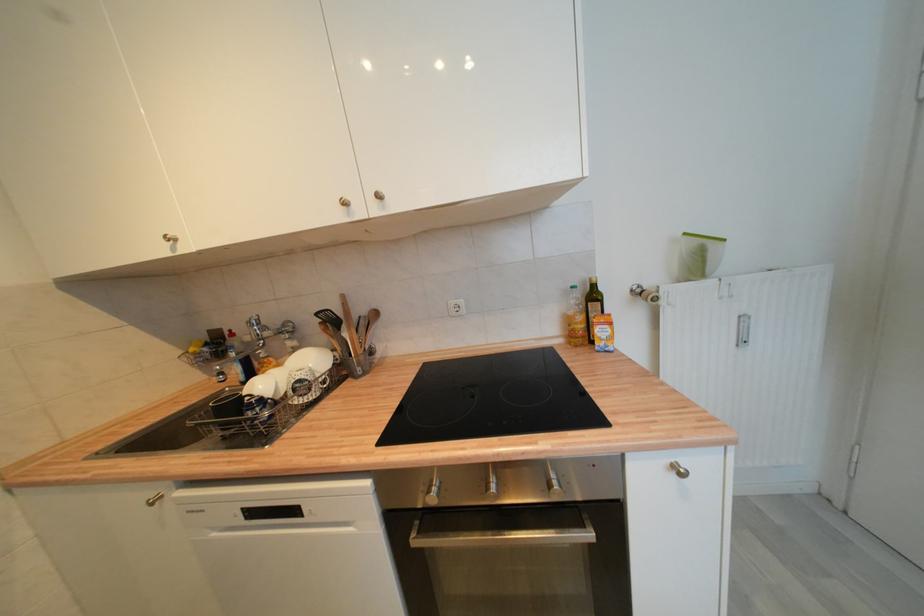
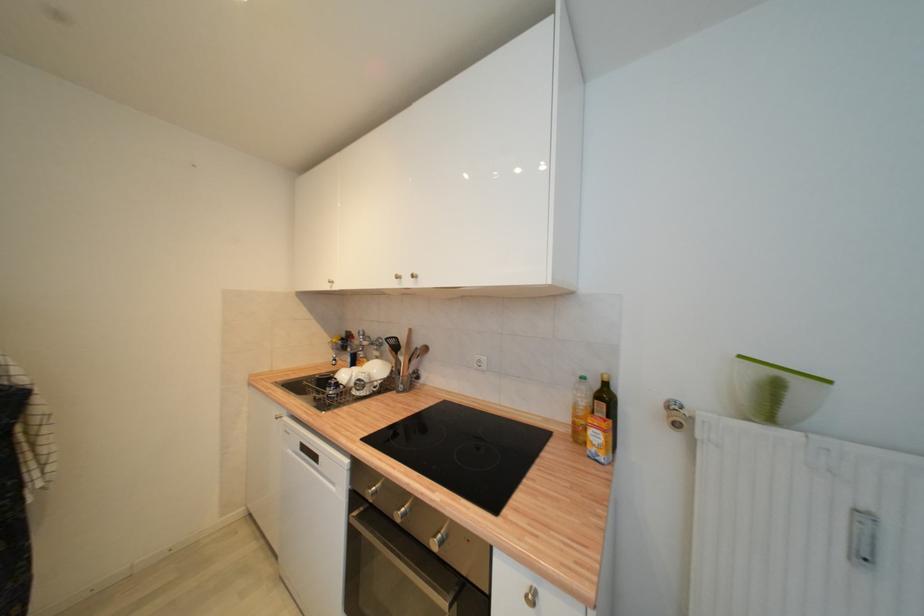
Where in the second image is the point corresponding to point 365,312 from the first image?

(422, 345)